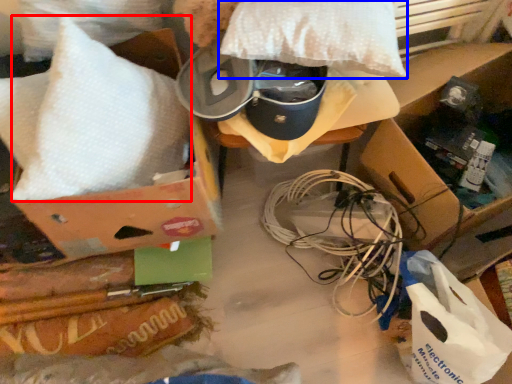
Question: Which point is further to the camera, pillow (highlighted by a red box) or pillow (highlighted by a blue box)?

Choices:
 (A) pillow
 (B) pillow

Answer: (B)